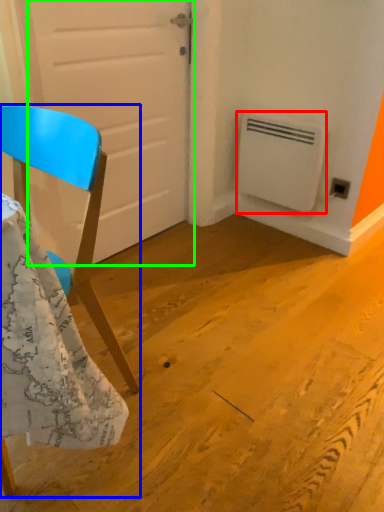
Question: Estimate the real-world distances between objects in this image. Which object is farther from air conditioning (highlighted by a red box), chair (highlighted by a blue box) or door (highlighted by a green box)?

Choices:
 (A) chair
 (B) door

Answer: (A)